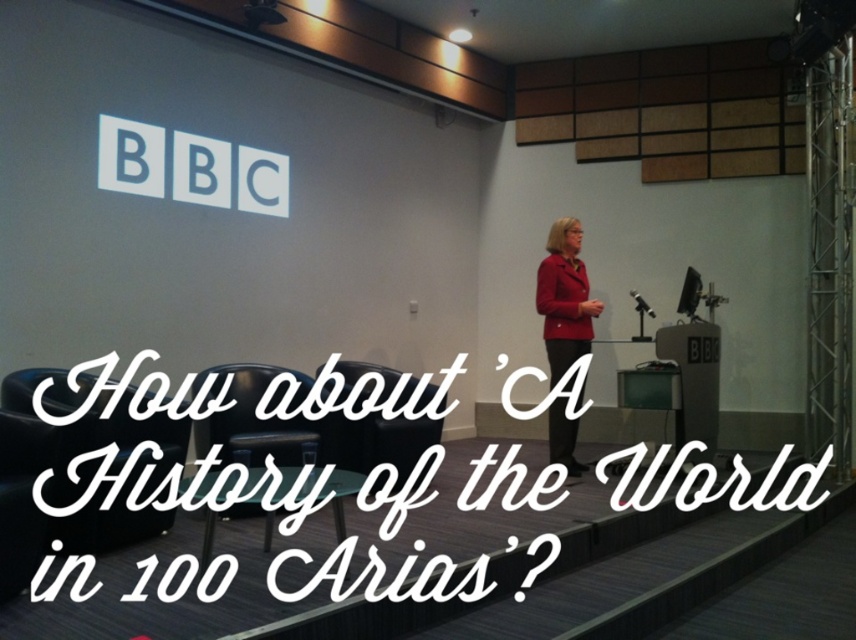
Question: Which is farther from the red smooth jacket at center?

Choices:
 (A) matte black screen at upper center
 (B) black leather chair at center
 (C) black plastic projector at upper center

Answer: (C)

Question: In this image, where is red smooth jacket at center located relative to black leather chair at center?

Choices:
 (A) left
 (B) right

Answer: (B)

Question: Does black leather chair at lower left appear over black plastic projector at upper center?

Choices:
 (A) no
 (B) yes

Answer: (A)

Question: Among these points, which one is farthest from the camera?

Choices:
 (A) (693, 268)
 (B) (302, 464)
 (C) (556, 401)

Answer: (A)

Question: Which object is the farthest from the black leather chair at center?

Choices:
 (A) red smooth jacket at center
 (B) matte black screen at upper center

Answer: (B)

Question: Is red smooth jacket at center thinner than black plastic projector at upper center?

Choices:
 (A) no
 (B) yes

Answer: (A)